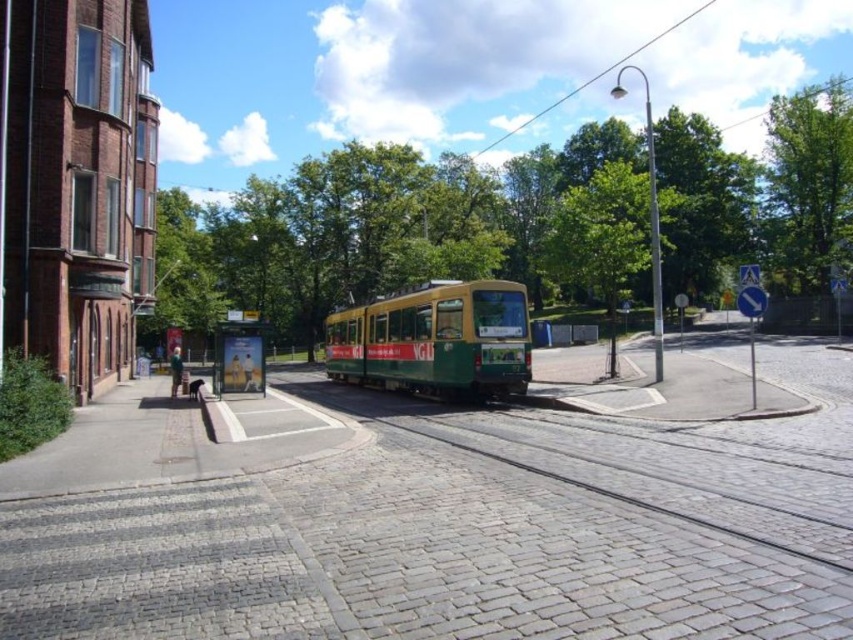
You are standing at the center of the image and want to walk towards the green metal train track at center. In which direction should you move?

The green metal train track at center is located at point (616, 468), so you should move towards the bottom right direction to reach it.

You are a city planner reviewing the tram system layout. The green metal train track at center and the green matte tram at center are both part of the design. Based on their spatial relationship, which one is narrower in width?

The green metal train track at center is narrower in width than the green matte tram at center because it occupies less space.

You are a maintenance worker checking the alignment of the green metal train track at center and the green matte tram at center. Based on the scene, which object is positioned lower in the image?

The green metal train track at center is located below the green matte tram at center, so it is positioned lower in the image.